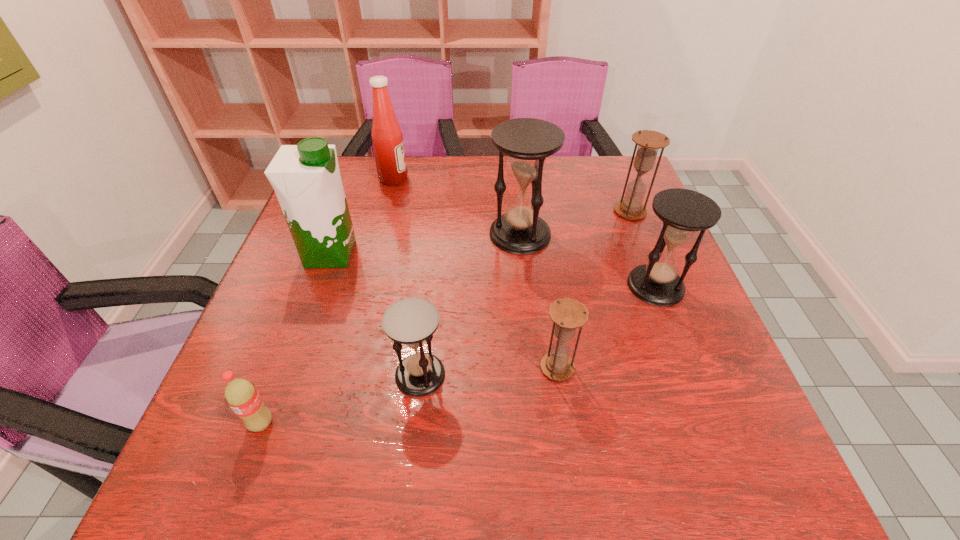
This screenshot has height=540, width=960. I want to click on vacant area that lies between the rightmost black hourglass and the nearest object, so click(x=459, y=355).

Identify the location of free space between the leftmost hourglass and the soda. (341, 399).

What are the coordinates of `vacant area that lies between the smallest black hourglass and the farther brown hourglass` in the screenshot? It's located at point(525,293).

Identify the location of object identified as the fifth closest to the third farthest hourglass. This screenshot has width=960, height=540. (306, 178).

The image size is (960, 540). Find the location of `object that stands as the sixth closest to the condiment`. object that stands as the sixth closest to the condiment is located at coordinates (567, 314).

Locate an element on the screen. hourglass that can be found as the third closest to the green soya milk is located at coordinates (567, 314).

Locate an element on the screen. hourglass that can be found as the second closest to the sixth object from right to left is located at coordinates (649, 142).

Locate which black hourglass is the second closest to the farthest black hourglass. Please provide its 2D coordinates. Your answer should be formatted as a tuple, i.e. [(x, y)], where the tuple contains the x and y coordinates of a point satisfying the conditions above.

[(411, 321)]

Identify the location of the second closest black hourglass to the farthest object. This screenshot has height=540, width=960. (411, 321).

Where is `blank area in the image that satisfies the following two spatial constraints: 1. on the front-facing side of the soya milk; 2. on the front side of the nearest object`? This screenshot has width=960, height=540. blank area in the image that satisfies the following two spatial constraints: 1. on the front-facing side of the soya milk; 2. on the front side of the nearest object is located at coordinates (270, 423).